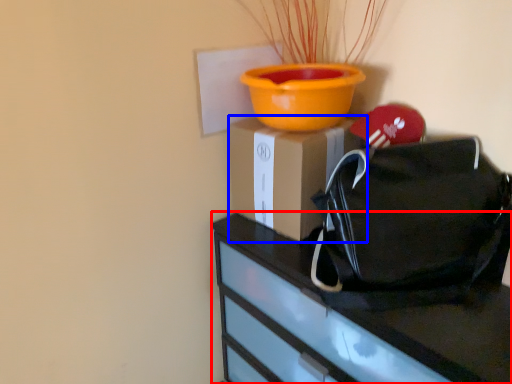
Question: Which point is further to the camera, furniture (highlighted by a red box) or cardboard box (highlighted by a blue box)?

Choices:
 (A) furniture
 (B) cardboard box

Answer: (B)